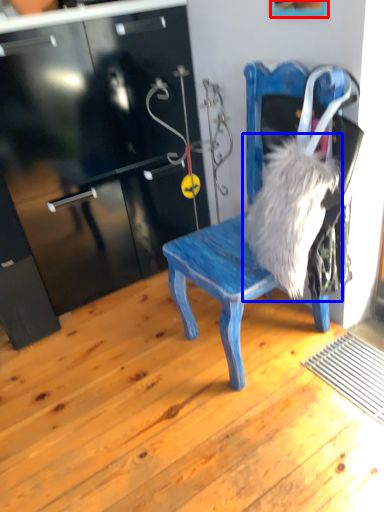
Question: Which object is closer to the camera taking this photo, picture frame (highlighted by a red box) or animal (highlighted by a blue box)?

Choices:
 (A) picture frame
 (B) animal

Answer: (A)